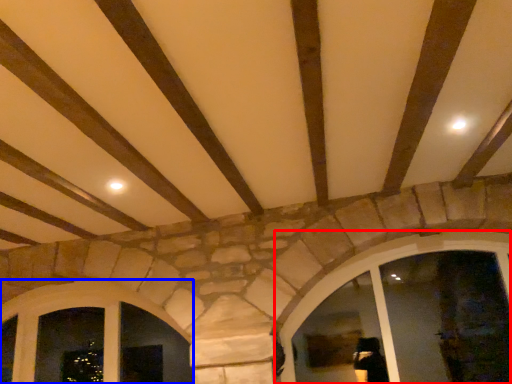
Question: Which point is further to the camera, window (highlighted by a red box) or window (highlighted by a blue box)?

Choices:
 (A) window
 (B) window

Answer: (B)